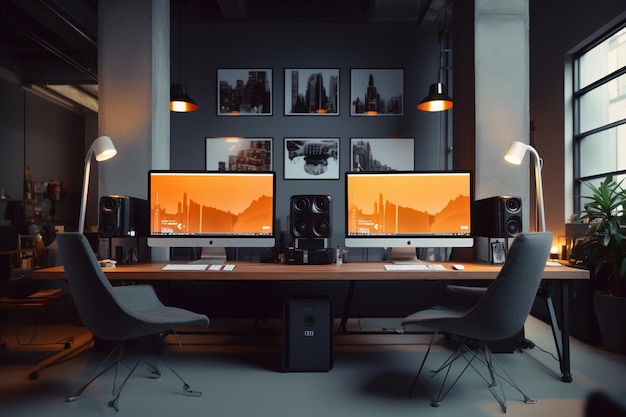
Locate an element on the screen. window is located at coordinates (603, 140).